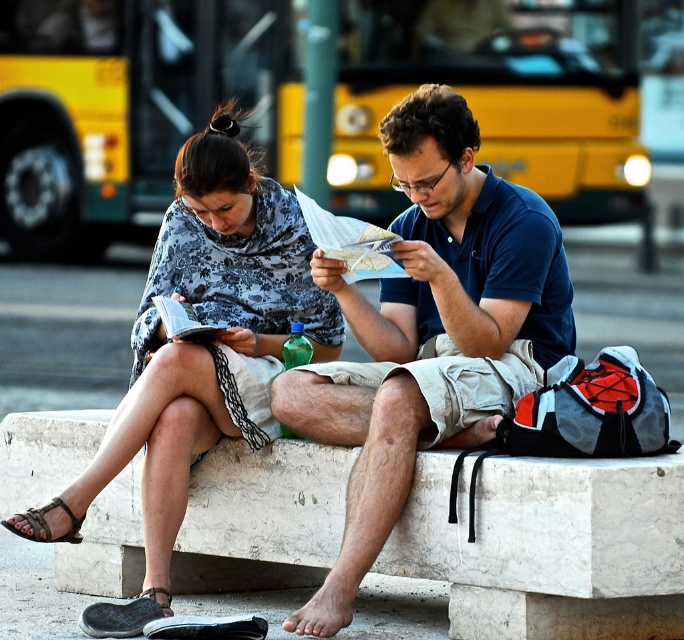
Identify the location of yellow metallic bus at upper center. The width and height of the screenshot is (684, 640). (129, 108).

Does yellow metallic bus at upper center appear under white marble bench at center?

Incorrect, yellow metallic bus at upper center is not positioned below white marble bench at center.

Where is `yellow metallic bus at upper center`? The width and height of the screenshot is (684, 640). yellow metallic bus at upper center is located at coordinates coord(129,108).

Between yellow metallic bus at upper center and blue cotton shirt at center, which one appears on the right side from the viewer's perspective?

blue cotton shirt at center

Is yellow metallic bus at upper center shorter than blue cotton shirt at center?

In fact, yellow metallic bus at upper center may be taller than blue cotton shirt at center.

Measure the distance between point (x=293, y=4) and camera.

Point (x=293, y=4) is 32.64 meters away from camera.

You are a GUI agent. You are given a task and a screenshot of the screen. Output one action in this format:
    pyautogui.click(x=<x>, y=<y>)
    Task: Click on the yellow metallic bus at upper center
    This screenshot has height=640, width=684.
    Given the screenshot: What is the action you would take?
    pyautogui.click(x=129, y=108)

Is point (289, 536) positioned after point (484, 193)?

No, it is in front of (484, 193).

You are a GUI agent. You are given a task and a screenshot of the screen. Output one action in this format:
    pyautogui.click(x=<x>, y=<y>)
    Task: Click on the white marble bench at center
    This screenshot has width=684, height=640.
    Given the screenshot: What is the action you would take?
    pyautogui.click(x=549, y=545)

This screenshot has height=640, width=684. What are the coordinates of `white marble bench at center` in the screenshot? It's located at (549, 545).